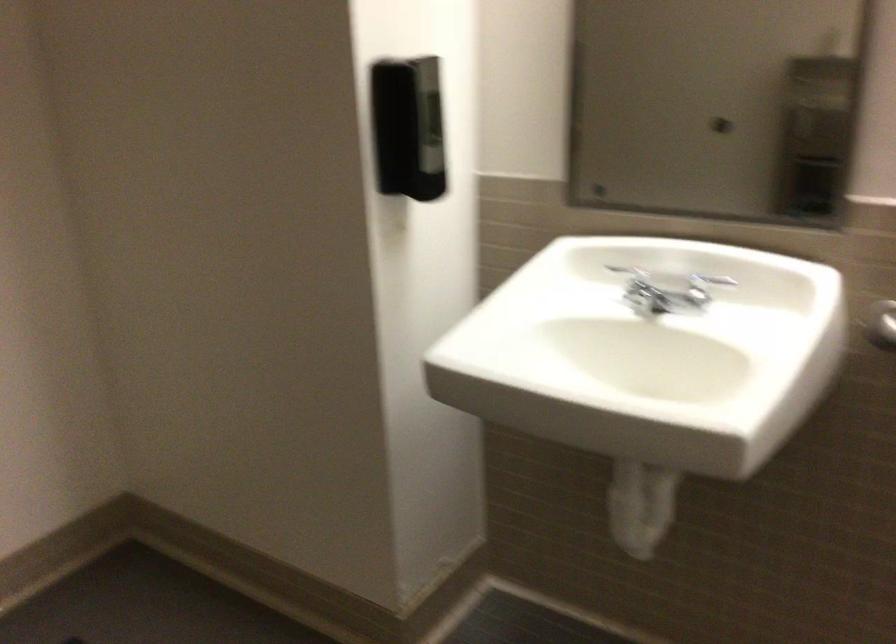
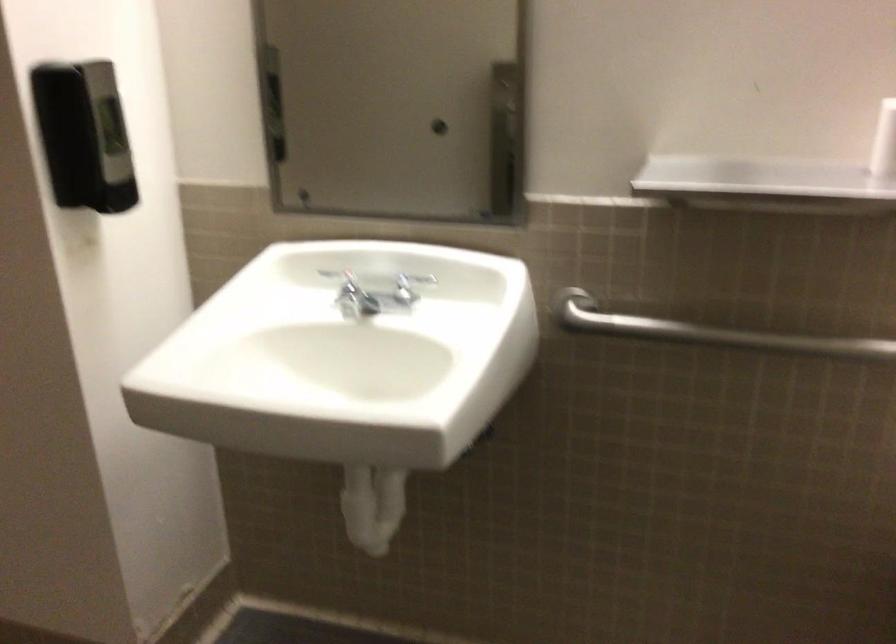
Where in the second image is the point corresponding to pixel 698 289 from the first image?

(403, 290)